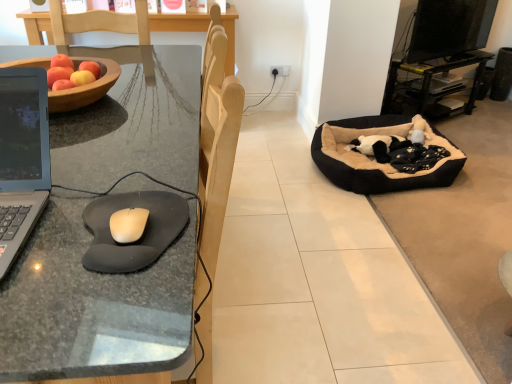
Question: Is black plastic entertainment center at right situated inside wooden bowl at left or outside?

Choices:
 (A) outside
 (B) inside

Answer: (A)

Question: Relative to wooden bowl at left, is black plastic entertainment center at right in front or behind?

Choices:
 (A) behind
 (B) front

Answer: (A)

Question: Which object is positioned closest to the black plastic entertainment center at right?

Choices:
 (A) black rubber mouse pad at left
 (B) black plush dog bed at right
 (C) black fabric speaker at upper right
 (D) silver metallic laptop at left
 (E) wooden bowl at left

Answer: (C)

Question: Which object is positioned farthest from the black plastic entertainment center at right?

Choices:
 (A) black rubber mouse pad at left
 (B) black fabric speaker at upper right
 (C) black glossy tv at upper right
 (D) black plush dog bed at right
 (E) black foam mousepad at left

Answer: (E)